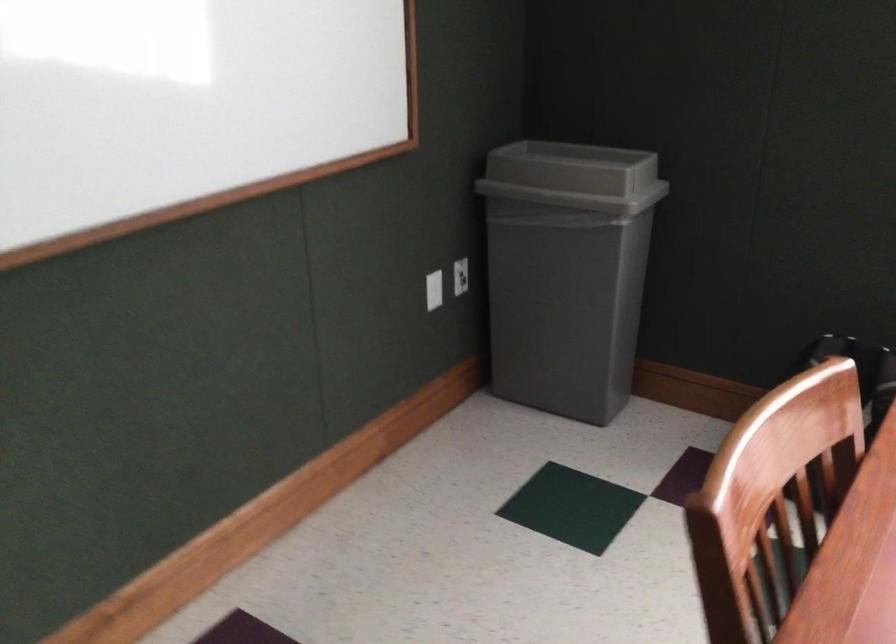
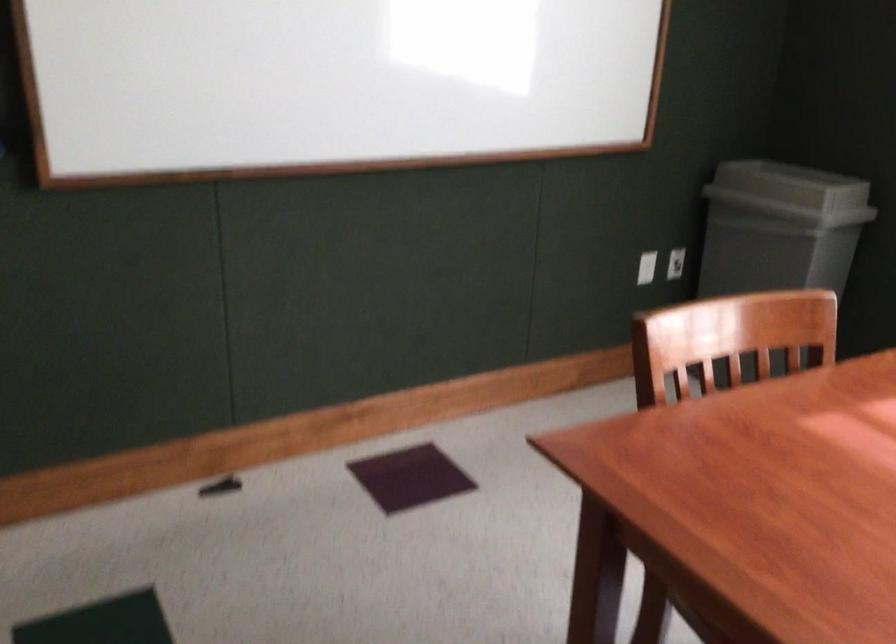
Locate, in the second image, the point that corresponds to (589,178) in the first image.

(791, 185)